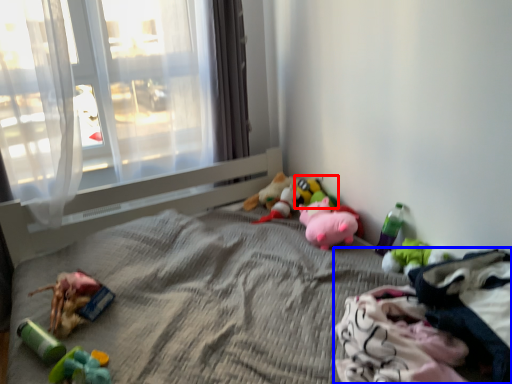
Question: Which point is further to the camera, toy (highlighted by a red box) or material (highlighted by a blue box)?

Choices:
 (A) toy
 (B) material

Answer: (A)